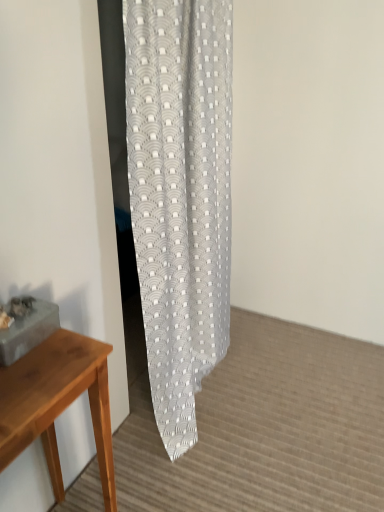
Describe the element at coordinates (57, 403) in the screenshot. The height and width of the screenshot is (512, 384). I see `wooden table at left` at that location.

What is the approximate width of wooden table at left?

The width of wooden table at left is 12.24 inches.

In order to face wooden table at left, should I rotate leftwards or rightwards?

Rotate your view left by about 19.891°.

You are a GUI agent. You are given a task and a screenshot of the screen. Output one action in this format:
    pyautogui.click(x=<x>, y=<y>)
    Task: Click on the wooden table at left
    
    Given the screenshot: What is the action you would take?
    pyautogui.click(x=57, y=403)

Where is `wooden table at left`? wooden table at left is located at coordinates (57, 403).